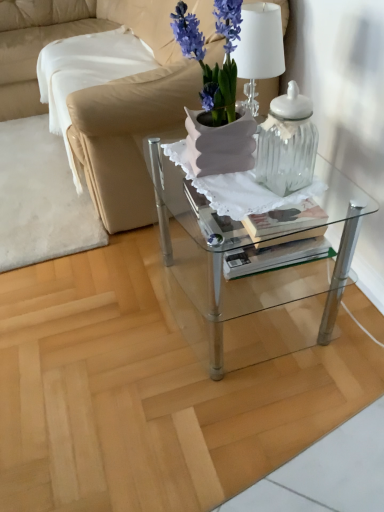
Find the location of a particular element. free space in front of clear glass table at center is located at coordinates (252, 422).